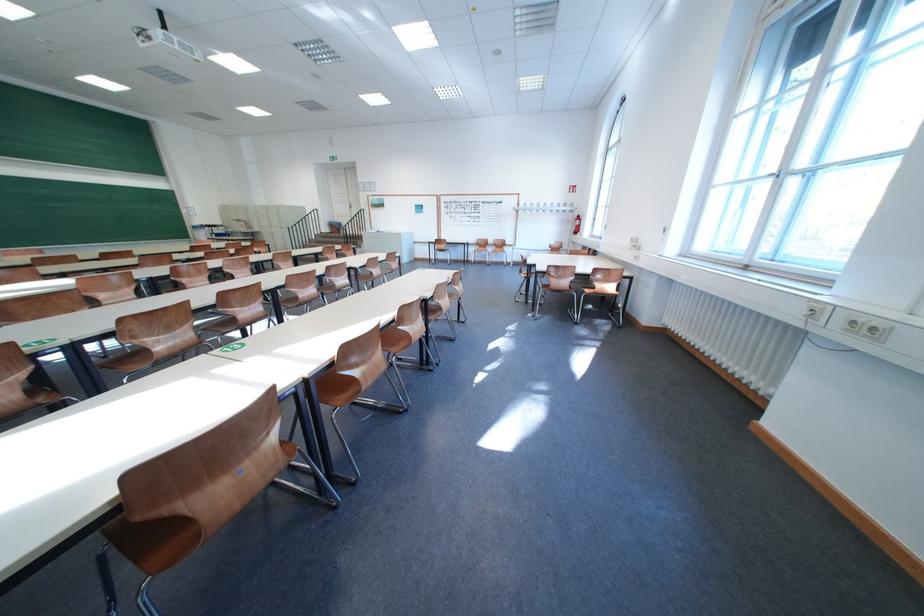
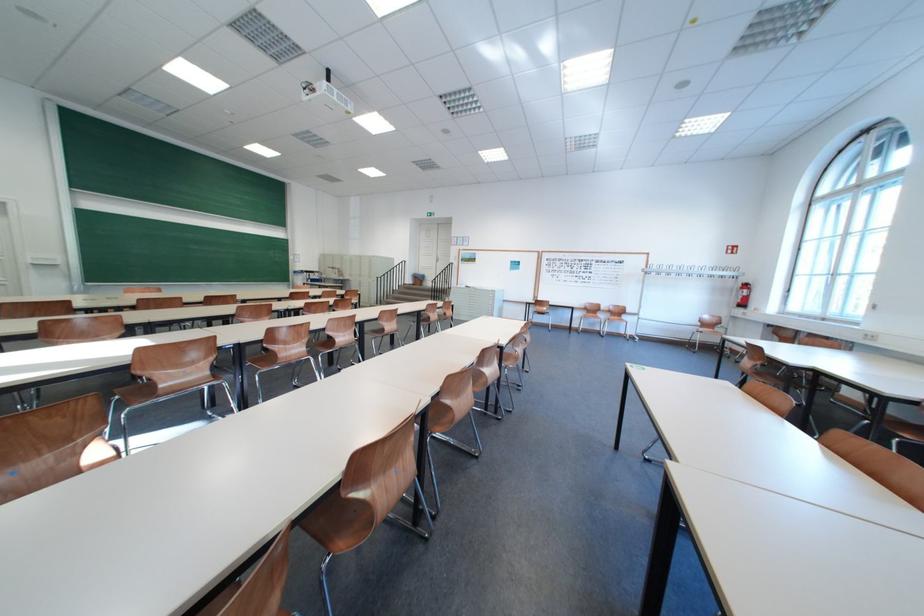
What movement of the cameraman would produce the second image?

The cameraman walked toward left, forward.